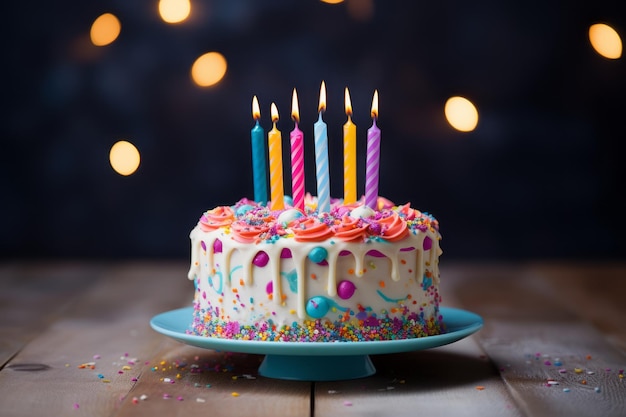
Find the location of a particular element. birthday candles is located at coordinates (350, 177), (275, 171), (255, 167), (293, 175), (321, 174), (372, 175).